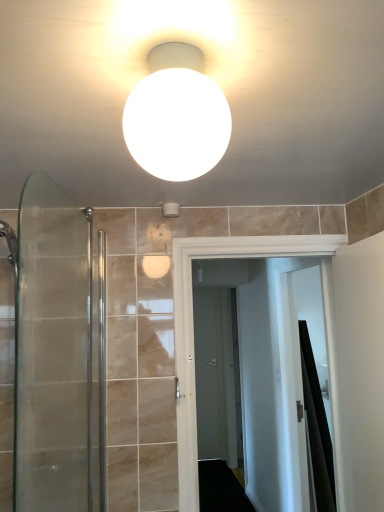
This screenshot has height=512, width=384. What do you see at coordinates (170, 209) in the screenshot?
I see `white matte toilet paper holder at upper center` at bounding box center [170, 209].

Where is `white matte toilet paper holder at upper center`? The width and height of the screenshot is (384, 512). white matte toilet paper holder at upper center is located at coordinates (170, 209).

Describe the element at coordinates (57, 356) in the screenshot. This screenshot has width=384, height=512. I see `clear glass shower door at left` at that location.

Locate an element on the screen. This screenshot has height=512, width=384. black fabric shower curtain at right is located at coordinates (317, 426).

Locate an element on the screen. Image resolution: width=384 pixels, height=512 pixels. matte gray door at center is located at coordinates (209, 374).

The image size is (384, 512). Find the location of `white matte toilet paper holder at upper center`. white matte toilet paper holder at upper center is located at coordinates point(170,209).

Where is `light fixture on the right of white matte toilet paper holder at upper center`? This screenshot has width=384, height=512. light fixture on the right of white matte toilet paper holder at upper center is located at coordinates (176, 116).

Between white matte toilet paper holder at upper center and white matte sphere at upper center, which one is positioned behind?

white matte toilet paper holder at upper center is behind.

From their relative heights in the image, would you say white matte toilet paper holder at upper center is taller or shorter than white matte sphere at upper center?

Clearly, white matte toilet paper holder at upper center is shorter compared to white matte sphere at upper center.

From the image's perspective, is white matte toilet paper holder at upper center beneath white matte sphere at upper center?

Yes, from the image's perspective, white matte toilet paper holder at upper center is below white matte sphere at upper center.

Is matte gray door at center not near black fabric shower curtain at right?

Yes, matte gray door at center and black fabric shower curtain at right are quite far apart.

From the picture: Is matte gray door at center not inside black fabric shower curtain at right?

matte gray door at center is positioned outside black fabric shower curtain at right.

This screenshot has width=384, height=512. In the image, there is a matte gray door at center. Find the location of `shower curtain above it (from the image's perspective)`. shower curtain above it (from the image's perspective) is located at coordinates (317, 426).

From the picture: From a real-world perspective, which is physically below, matte gray door at center or black fabric shower curtain at right?

From a 3D spatial view, black fabric shower curtain at right is below.

Is white glossy door at center touching black fabric shower curtain at right?

white glossy door at center is not next to black fabric shower curtain at right, and they're not touching.

Could you tell me if white glossy door at center is facing black fabric shower curtain at right?

No, white glossy door at center is not facing towards black fabric shower curtain at right.

How many degrees apart are the facing directions of white glossy door at center and black fabric shower curtain at right?

white glossy door at center and black fabric shower curtain at right are facing 0.246 degrees away from each other.

In the image, is white glossy door at center positioned in front of or behind black fabric shower curtain at right?

white glossy door at center is in front of black fabric shower curtain at right.

Locate an element on the screen. This screenshot has width=384, height=512. shower door in front of the matte gray door at center is located at coordinates (57, 356).

Is matte gray door at center facing away from clear glass shower door at left?

matte gray door at center does not have its back to clear glass shower door at left.

Which object is further away from the camera, matte gray door at center or clear glass shower door at left?

matte gray door at center is further from the camera.

Looking at this image, from the image's perspective, is matte gray door at center over clear glass shower door at left?

No, from the image's perspective, matte gray door at center is not over clear glass shower door at left.

From their relative heights in the image, would you say white glossy door at center is taller or shorter than white matte sphere at upper center?

Considering their sizes, white glossy door at center has more height than white matte sphere at upper center.

Identify the location of light fixture located above the white glossy door at center (from a real-world perspective). The image size is (384, 512). (176, 116).

How different are the orientations of white glossy door at center and white matte sphere at upper center in degrees?

The angular difference between white glossy door at center and white matte sphere at upper center is 180 degrees.

From the image's perspective, who appears lower, white glossy door at center or white matte sphere at upper center?

white glossy door at center, from the image's perspective.

From a real-world perspective, is white matte sphere at upper center over clear glass shower door at left?

Yes, from a real-world perspective, white matte sphere at upper center is above clear glass shower door at left.

Does point (175, 74) come in front of point (46, 498)?

That is True.

From their relative heights in the image, would you say white matte sphere at upper center is taller or shorter than clear glass shower door at left?

Considering their sizes, white matte sphere at upper center has less height than clear glass shower door at left.

Is white matte sphere at upper center positioned with its back to clear glass shower door at left?

No.

Would you say white matte sphere at upper center is part of clear glass shower door at left's contents?

That's incorrect, white matte sphere at upper center is not inside clear glass shower door at left.

Considering the sizes of objects clear glass shower door at left and white matte sphere at upper center in the image provided, who is thinner, clear glass shower door at left or white matte sphere at upper center?

clear glass shower door at left.

Locate an element on the screen. light fixture in front of the clear glass shower door at left is located at coordinates (176, 116).

Which of these two, clear glass shower door at left or white matte sphere at upper center, stands taller?

clear glass shower door at left.

This screenshot has height=512, width=384. Identify the location of fixture to the left of white matte sphere at upper center. (170, 209).

Image resolution: width=384 pixels, height=512 pixels. In the image, there is a black fabric shower curtain at right. What are the coordinates of `screen door below it (from the image's perspective)` in the screenshot? It's located at (209, 374).

From the image, which object appears to be nearer to white matte toilet paper holder at upper center, matte gray door at center or black fabric shower curtain at right?

black fabric shower curtain at right is positioned closer to the anchor white matte toilet paper holder at upper center.

From the image, which object appears to be farther from white matte sphere at upper center, white matte toilet paper holder at upper center or white glossy door at center?

white glossy door at center.

When comparing their distances from white matte sphere at upper center, does matte gray door at center or clear glass shower door at left seem closer?

clear glass shower door at left is positioned closer to the anchor white matte sphere at upper center.

Considering their positions, is white matte sphere at upper center positioned closer to white matte toilet paper holder at upper center than matte gray door at center?

white matte sphere at upper center is positioned closer to the anchor white matte toilet paper holder at upper center.

From the picture: Estimate the real-world distances between objects in this image. Which object is further from matte gray door at center, clear glass shower door at left or white glossy door at center?

Based on the image, clear glass shower door at left appears to be further to matte gray door at center.

Consider the image. Estimate the real-world distances between objects in this image. Which object is closer to white matte sphere at upper center, white glossy door at center or black fabric shower curtain at right?

Among the two, white glossy door at center is located nearer to white matte sphere at upper center.

Looking at the image, which one is located closer to white matte toilet paper holder at upper center, black fabric shower curtain at right or white glossy door at center?

white glossy door at center is closer to white matte toilet paper holder at upper center.

Estimate the real-world distances between objects in this image. Which object is closer to white glossy door at center, white matte toilet paper holder at upper center or white matte sphere at upper center?

white matte toilet paper holder at upper center.

You are a GUI agent. You are given a task and a screenshot of the screen. Output one action in this format:
    pyautogui.click(x=<x>, y=<y>)
    Task: Click on the shower door between white matte sphere at upper center and white glossy door at center in the front-back direction
    
    Given the screenshot: What is the action you would take?
    pyautogui.click(x=57, y=356)

This screenshot has height=512, width=384. I want to click on shower curtain between white matte sphere at upper center and matte gray door at center along the z-axis, so click(x=317, y=426).

Find the location of a particular element. Image resolution: width=384 pixels, height=512 pixels. shower door between white matte sphere at upper center and black fabric shower curtain at right in the front-back direction is located at coordinates (57, 356).

I want to click on shower curtain located between clear glass shower door at left and matte gray door at center in the depth direction, so click(x=317, y=426).